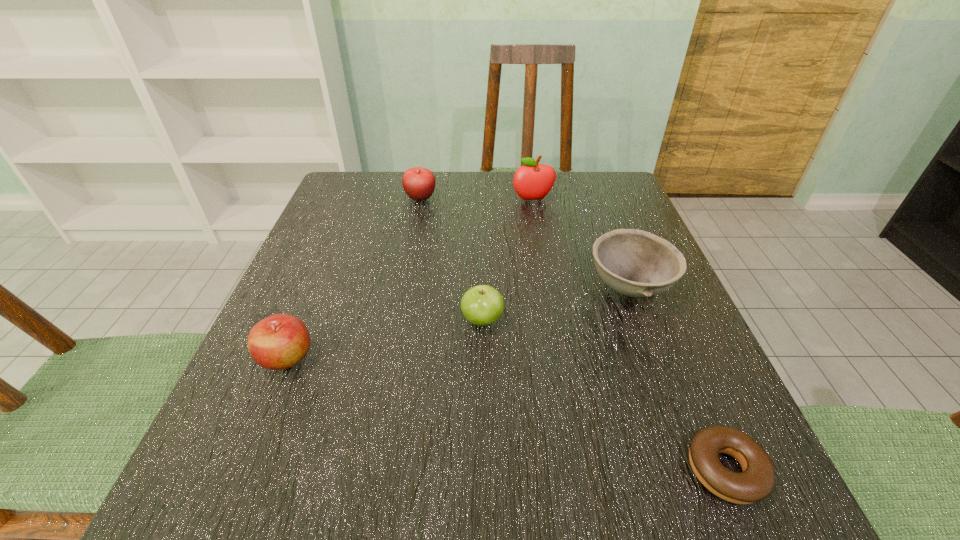
I want to click on the tallest object, so click(x=532, y=181).

I want to click on the rightmost apple, so click(532, 181).

Identify the location of the third apple from right to left. The height and width of the screenshot is (540, 960). (419, 183).

Where is `the third apple from left to right`? Image resolution: width=960 pixels, height=540 pixels. the third apple from left to right is located at coordinates (482, 305).

Find the location of a particular element. Image resolution: width=960 pixels, height=540 pixels. the second nearest apple is located at coordinates (482, 305).

This screenshot has width=960, height=540. What are the coordinates of `the leftmost object` in the screenshot? It's located at (280, 341).

The image size is (960, 540). What are the coordinates of `the fifth farthest object` in the screenshot? It's located at (280, 341).

This screenshot has height=540, width=960. I want to click on bowl, so click(x=635, y=263).

At what (x,y) coordinates should I click in order to perform the action: click on the nearest object. Please return your answer as a coordinate pair (x, y). The height and width of the screenshot is (540, 960). Looking at the image, I should click on (756, 482).

Locate an element on the screen. This screenshot has height=540, width=960. doughnut is located at coordinates (756, 482).